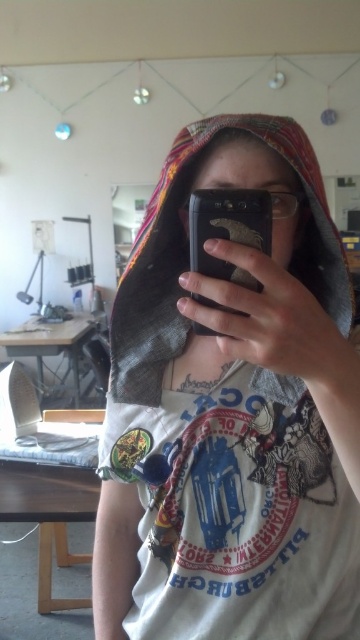
Between point (151, 275) and point (195, 212), which one is positioned behind?

Point (151, 275)

Between denim jacket at center and black matte smartphone at center, which one has more height?

denim jacket at center

Locate an element on the screen. denim jacket at center is located at coordinates (231, 412).